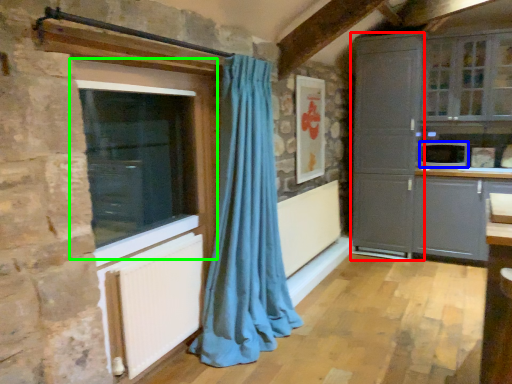
Question: Considering the real-world distances, which object is farthest from screen door (highlighted by a red box)? appliance (highlighted by a blue box) or window (highlighted by a green box)?

Choices:
 (A) appliance
 (B) window

Answer: (B)